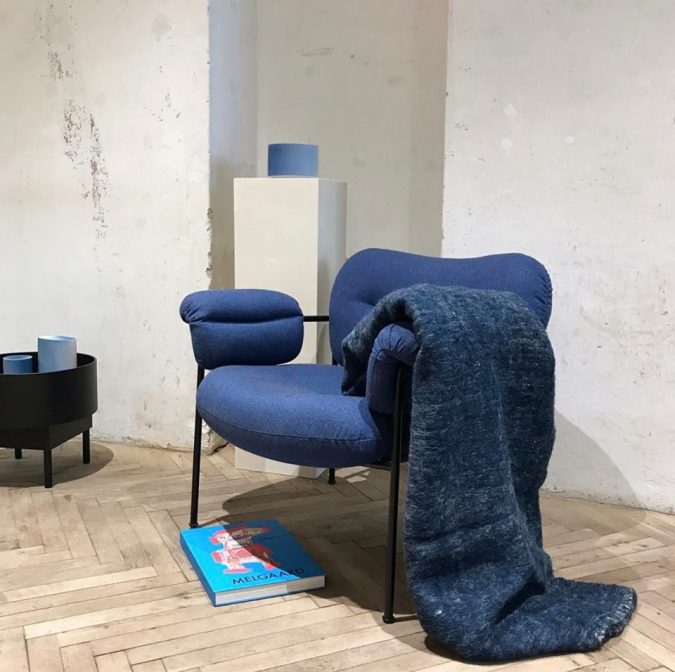
At what (x,y) coordinates should I click in order to perform the action: click on chair. Please return your answer as a coordinate pair (x, y). This screenshot has width=675, height=672. Looking at the image, I should click on (329, 412).